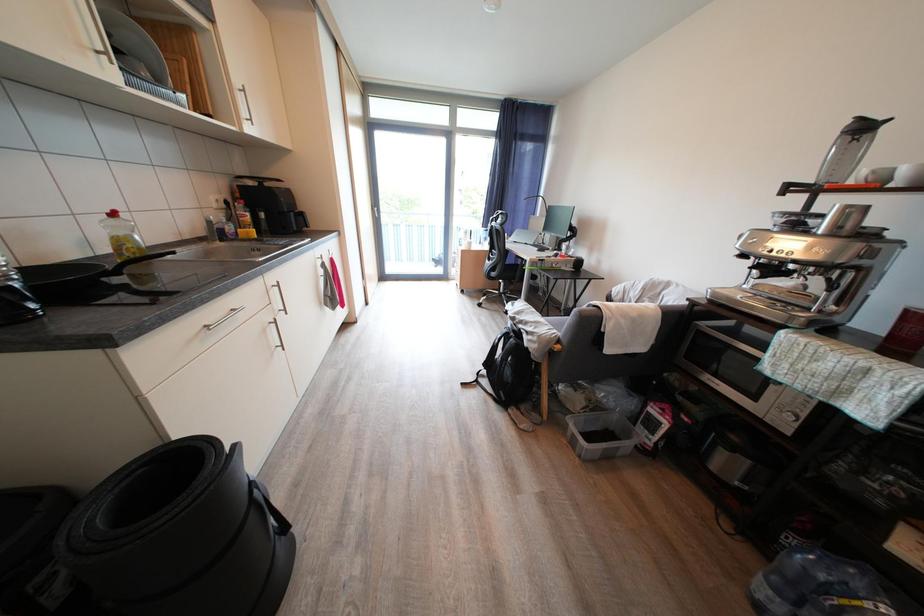
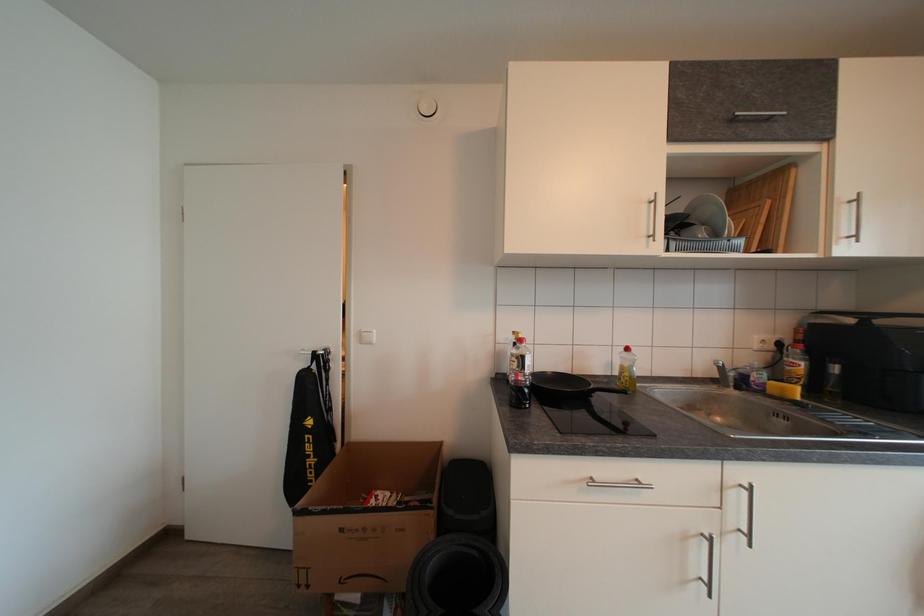
Question: The camera is either moving clockwise (left) or counter-clockwise (right) around the object. The first image is from the beginning of the video and the second image is from the end. Is the camera moving left or right when shooting the video?

Choices:
 (A) Left
 (B) Right

Answer: (B)